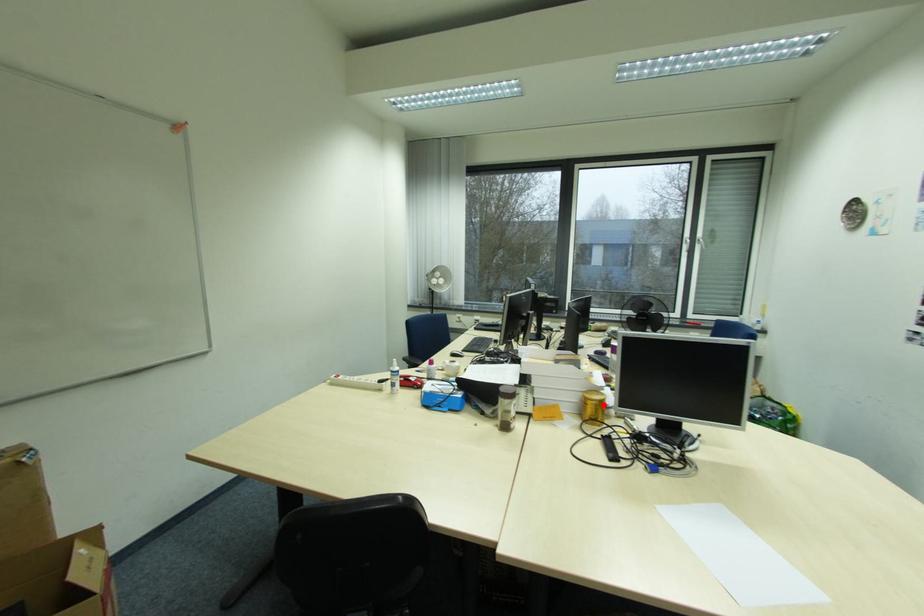
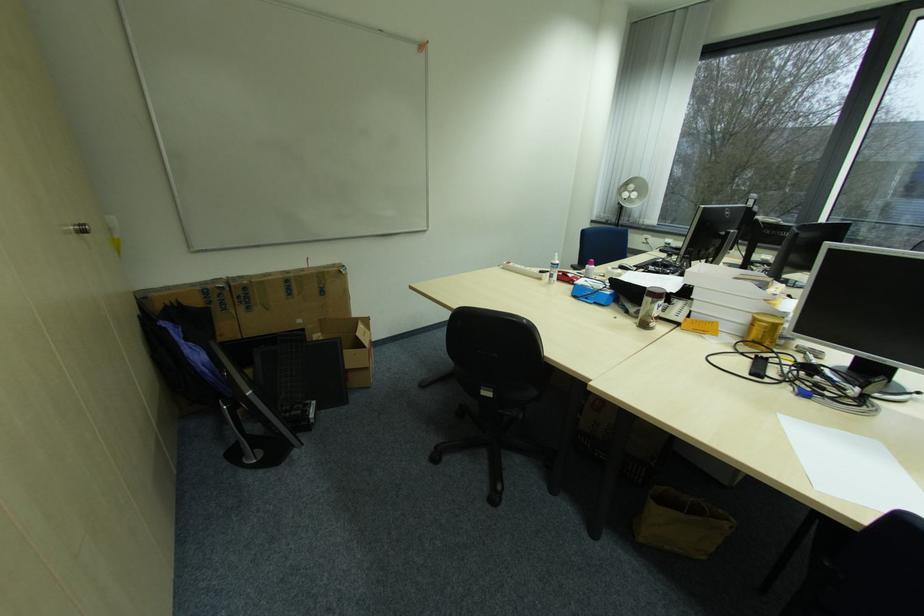
Find the pixel in the second image that matches the highlighted location in the first image.

(773, 329)